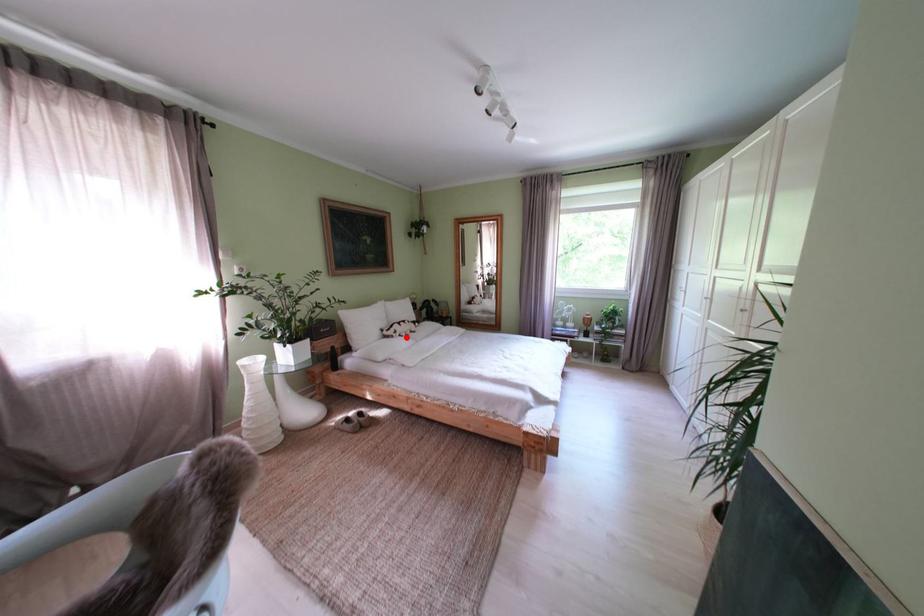
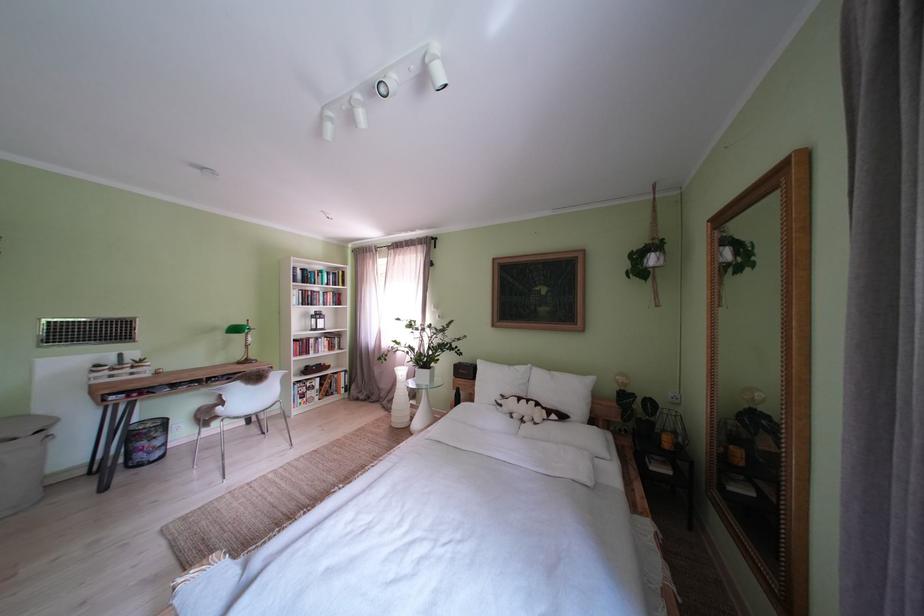
Question: I am providing you with two images of the same scene from different viewpoints. A red point is shown in image1. For the corresponding object point in image2, is it positioned nearer or farther from the camera?

Choices:
 (A) Nearer
 (B) Farther

Answer: (B)